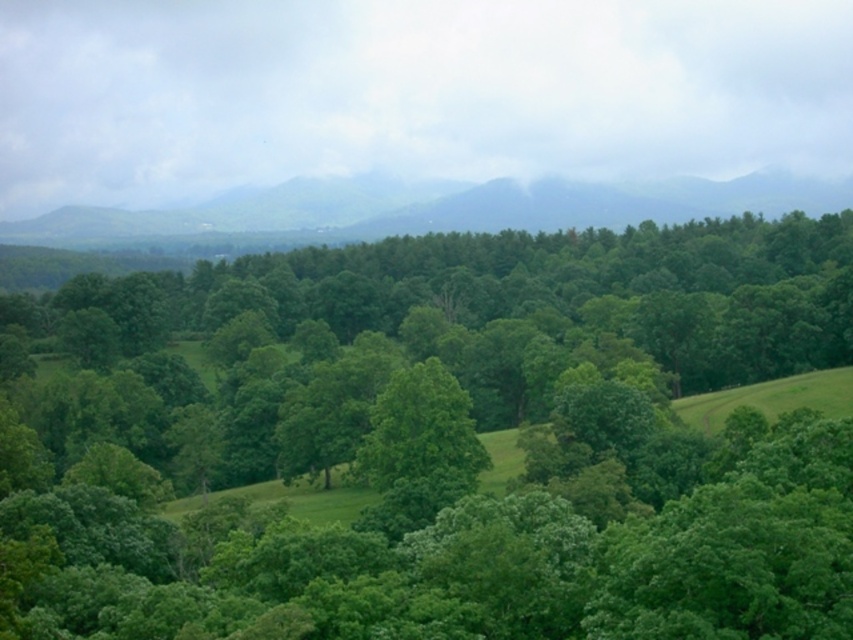
You are a hiker standing at the base of the green leafy forest at center and the green matte mountain at upper center. Which one do you need to look up more to see the top of?

You need to look up more to see the top of the green leafy forest at center because it is much taller than the green matte mountain at upper center.

Consider the image. You are an environmental scientist assessing the landscape. You need to determine which area covers more ground between the green leafy forest at center and the green matte mountain at upper center. Based on the scene, which one do you think occupies a greater area?

The green leafy forest at center has a larger size compared to the green matte mountain at upper center, so it occupies a greater area.

You are standing in the lush landscape and want to walk towards the green matte mountain at upper center. Which direction should you move relative to the green leafy forest at center?

To reach the green matte mountain at upper center, you should move to the right of the green leafy forest at center since the green leafy forest at center is located to the left of the mountain.